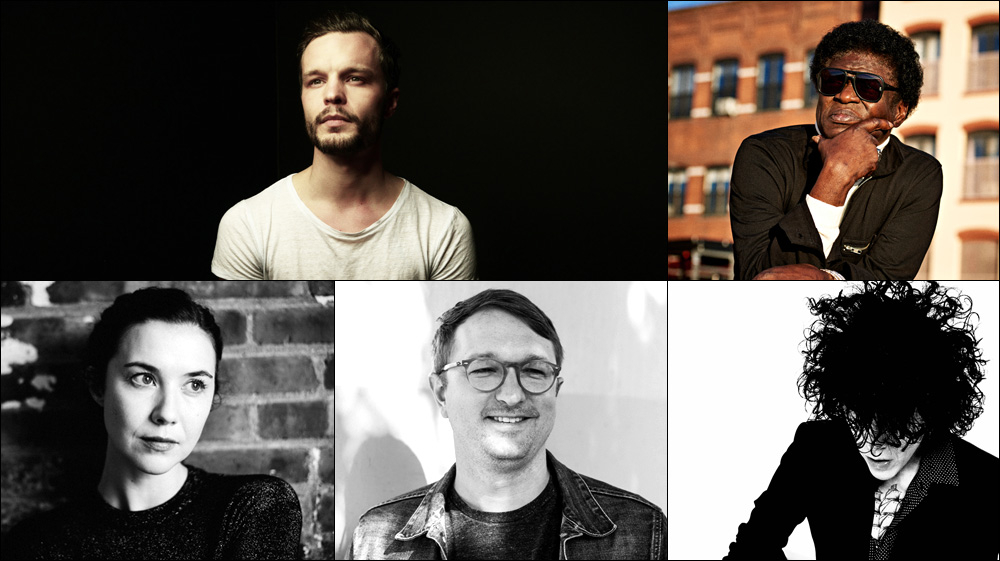
Where is `portraits in a collage`? The image size is (1000, 561). portraits in a collage is located at coordinates (356, 82), (172, 380), (484, 384), (883, 387), (861, 103).